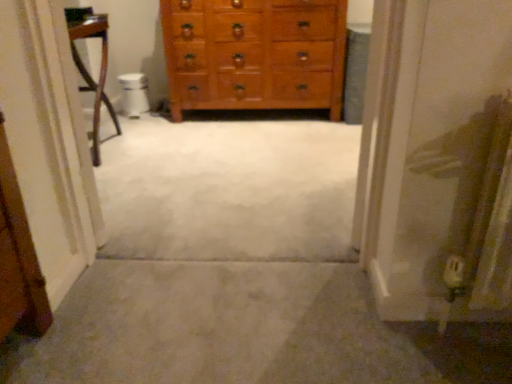
Question: Can you confirm if wooden chest of drawers at center is wider than carpet at center?

Choices:
 (A) yes
 (B) no

Answer: (B)

Question: Considering the relative positions of wooden chest of drawers at center and carpet at center in the image provided, is wooden chest of drawers at center behind carpet at center?

Choices:
 (A) no
 (B) yes

Answer: (B)

Question: Does wooden chest of drawers at center have a larger size compared to carpet at center?

Choices:
 (A) yes
 (B) no

Answer: (A)

Question: Is wooden chest of drawers at center to the right of carpet at center from the viewer's perspective?

Choices:
 (A) no
 (B) yes

Answer: (A)

Question: Does wooden chest of drawers at center touch carpet at center?

Choices:
 (A) no
 (B) yes

Answer: (A)

Question: Considering the positions of white glossy toilet bowl at center and carpet at center in the image, is white glossy toilet bowl at center wider or thinner than carpet at center?

Choices:
 (A) wide
 (B) thin

Answer: (B)

Question: Is white glossy toilet bowl at center inside or outside of carpet at center?

Choices:
 (A) inside
 (B) outside

Answer: (B)

Question: Considering the positions of white glossy toilet bowl at center and carpet at center in the image, is white glossy toilet bowl at center bigger or smaller than carpet at center?

Choices:
 (A) big
 (B) small

Answer: (B)

Question: In the image, is white glossy toilet bowl at center positioned in front of or behind carpet at center?

Choices:
 (A) behind
 (B) front

Answer: (A)

Question: Is carpet at center in front of or behind white glossy toilet bowl at center in the image?

Choices:
 (A) behind
 (B) front

Answer: (B)

Question: Is carpet at center to the left or to the right of white glossy toilet bowl at center in the image?

Choices:
 (A) right
 (B) left

Answer: (A)

Question: Is point 31,349 closer or farther from the camera than point 138,92?

Choices:
 (A) closer
 (B) farther

Answer: (A)

Question: Which is correct: carpet at center is inside white glossy toilet bowl at center, or outside of it?

Choices:
 (A) inside
 (B) outside

Answer: (B)

Question: From their relative heights in the image, would you say carpet at center is taller or shorter than wooden chest of drawers at center?

Choices:
 (A) short
 (B) tall

Answer: (A)

Question: Considering their positions, is carpet at center located in front of or behind wooden chest of drawers at center?

Choices:
 (A) front
 (B) behind

Answer: (A)